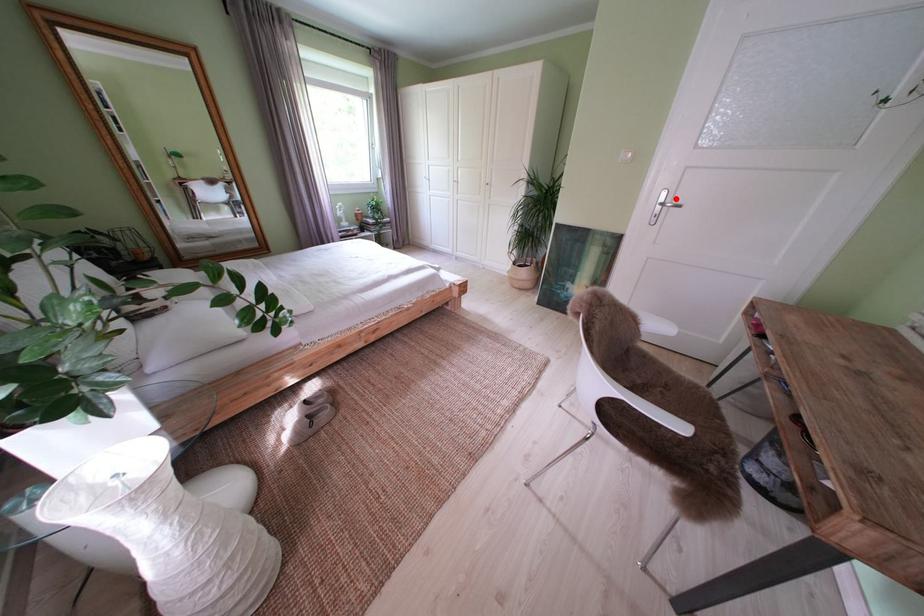
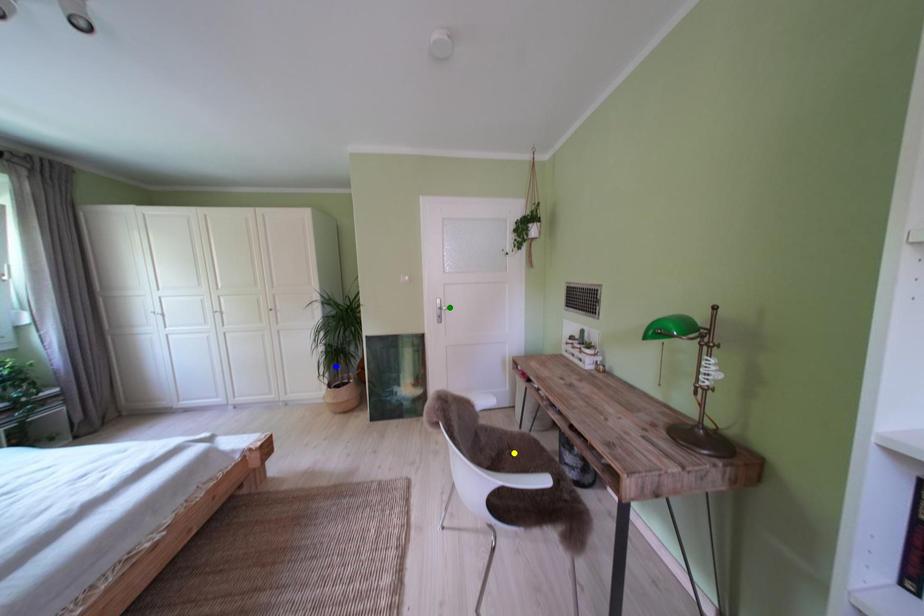
Question: I am providing you with two images of the same scene from different viewpoints. A red point is marked on the first image. You are given multiple points on the second image. Can you choose the point in image 2 that corresponds to the point in image 1?

Choices:
 (A) yellow point
 (B) green point
 (C) blue point

Answer: (B)